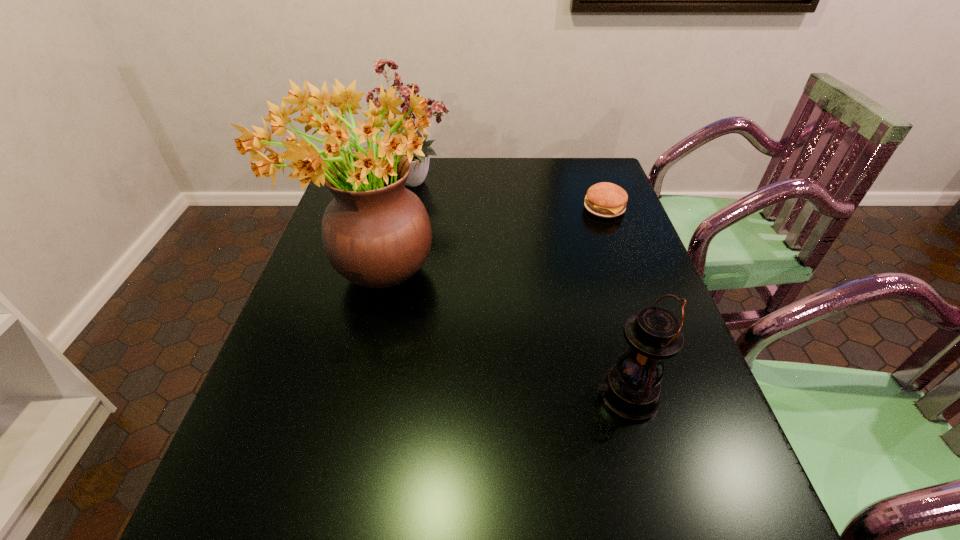
In the image, there is a desktop. Where is `vacant space at the far right corner`? This screenshot has height=540, width=960. vacant space at the far right corner is located at coordinates (594, 165).

Where is `empty space that is in between the hamburger and the third shortest object`? empty space that is in between the hamburger and the third shortest object is located at coordinates (511, 194).

Identify the location of free space that is in between the second tallest object and the shortest object. (511, 194).

Find the location of a particular element. The width and height of the screenshot is (960, 540). free space between the hamburger and the lantern is located at coordinates (615, 302).

Where is `vacant area that lies between the third tallest object and the farthest object`? This screenshot has height=540, width=960. vacant area that lies between the third tallest object and the farthest object is located at coordinates (521, 288).

The height and width of the screenshot is (540, 960). What are the coordinates of `free space between the third tallest object and the hamburger` in the screenshot? It's located at (615, 302).

Find the location of `free space between the nearest object and the second farthest object`. free space between the nearest object and the second farthest object is located at coordinates (615, 302).

Find the location of a particular element. vacant point located between the third tallest object and the third shortest object is located at coordinates (521, 288).

Identify the location of free space between the shortest object and the third farthest object. (489, 242).

Identify which object is the third closest to the nearer flower arrangement. Please provide its 2D coordinates. Your answer should be formatted as a tuple, i.e. [(x, y)], where the tuple contains the x and y coordinates of a point satisfying the conditions above.

[(607, 200)]